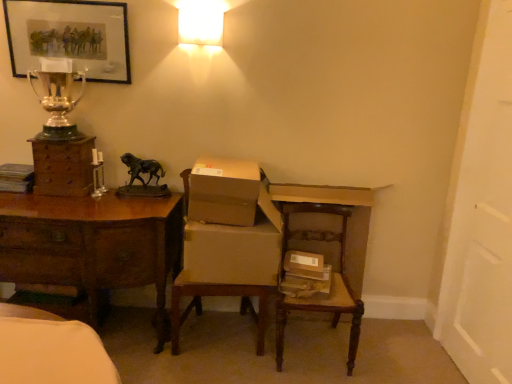
Question: Can you confirm if brown cardboard chair at center is smaller than brown wood desk at left?

Choices:
 (A) no
 (B) yes

Answer: (B)

Question: Is brown cardboard chair at center bigger than brown wood desk at left?

Choices:
 (A) no
 (B) yes

Answer: (A)

Question: From the image's perspective, is brown cardboard chair at center over brown wood desk at left?

Choices:
 (A) yes
 (B) no

Answer: (A)

Question: Is brown cardboard chair at center in front of brown wood desk at left?

Choices:
 (A) no
 (B) yes

Answer: (A)

Question: Is brown cardboard chair at center positioned far away from brown wood desk at left?

Choices:
 (A) no
 (B) yes

Answer: (A)

Question: From a real-world perspective, relative to brown cardboard chair at center, is brown cardboard box at center, the second cardboard box ordered from the bottom, vertically above or below?

Choices:
 (A) below
 (B) above

Answer: (B)

Question: Is point (207, 182) positioned closer to the camera than point (186, 294)?

Choices:
 (A) farther
 (B) closer

Answer: (B)

Question: Relative to brown cardboard chair at center, is brown cardboard box at center, the 1th cardboard box from the top, in front or behind?

Choices:
 (A) front
 (B) behind

Answer: (B)

Question: Based on their positions, is brown cardboard box at center, the 1th cardboard box from the top, located to the left or right of brown cardboard chair at center?

Choices:
 (A) left
 (B) right

Answer: (B)

Question: Is brown wood desk at left spatially inside wooden chest of drawers at left, or outside of it?

Choices:
 (A) inside
 (B) outside

Answer: (B)

Question: Looking at their shapes, would you say brown wood desk at left is wider or thinner than wooden chest of drawers at left?

Choices:
 (A) wide
 (B) thin

Answer: (A)

Question: From a real-world perspective, is brown wood desk at left physically located above or below wooden chest of drawers at left?

Choices:
 (A) below
 (B) above

Answer: (A)

Question: Is brown wood desk at left in front of or behind wooden chest of drawers at left in the image?

Choices:
 (A) behind
 (B) front

Answer: (B)

Question: Relative to bronze/statue at center, is brown cardboard box at center, the 1th cardboard box from the top, in front or behind?

Choices:
 (A) behind
 (B) front

Answer: (B)

Question: Considering the positions of brown cardboard box at center, the second cardboard box ordered from the bottom, and bronze/statue at center in the image, is brown cardboard box at center, the second cardboard box ordered from the bottom, bigger or smaller than bronze/statue at center?

Choices:
 (A) big
 (B) small

Answer: (A)